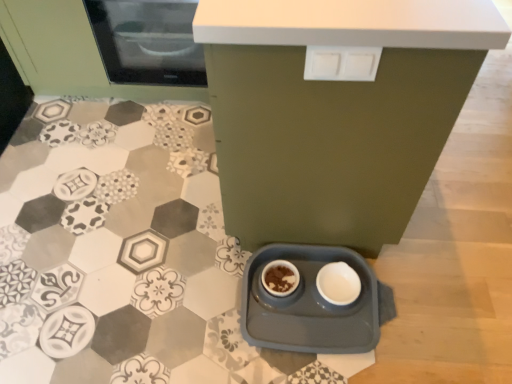
Find the location of a particular element. free space in front of matte ceramic bowl at center is located at coordinates (286, 330).